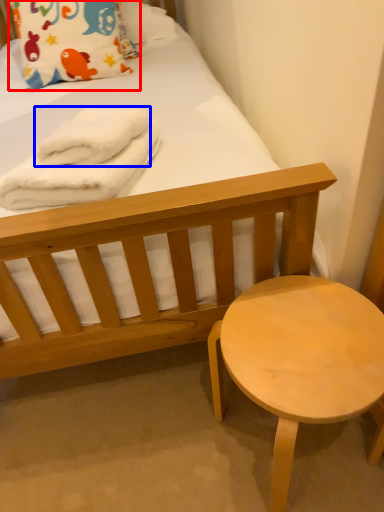
Question: Which point is closer to the camera, pillow (highlighted by a red box) or bath towel (highlighted by a blue box)?

Choices:
 (A) pillow
 (B) bath towel

Answer: (B)